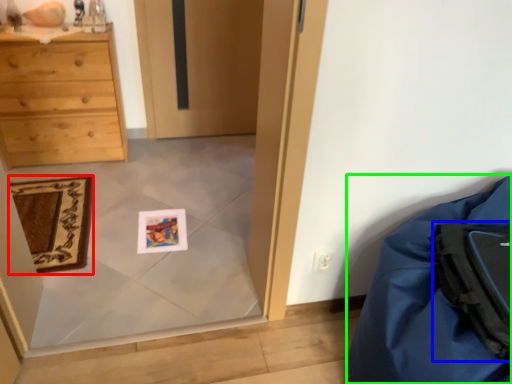
Question: Which object is positioned farthest from mat (highlighted by a red box)? Select from backpack (highlighted by a blue box) and furniture (highlighted by a green box).

Choices:
 (A) backpack
 (B) furniture

Answer: (A)